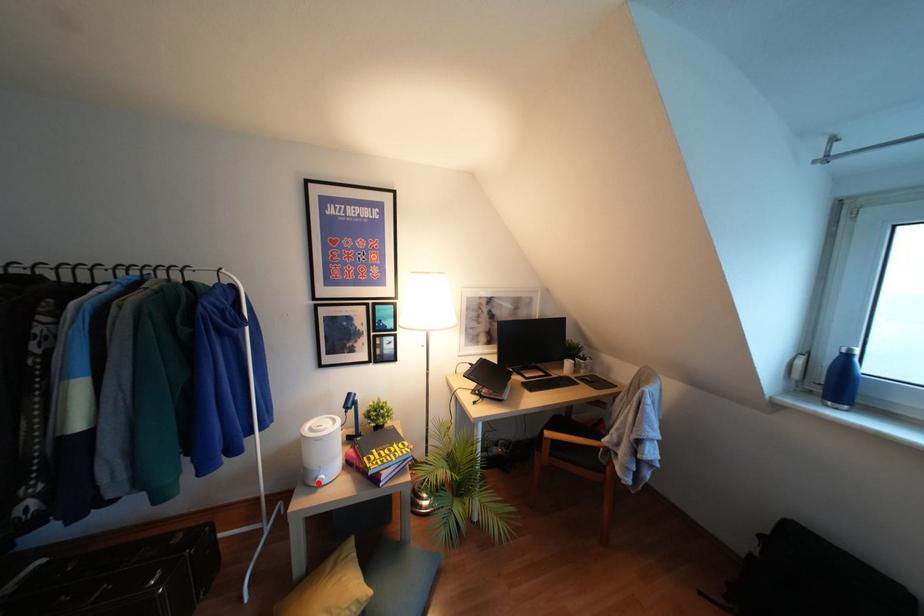
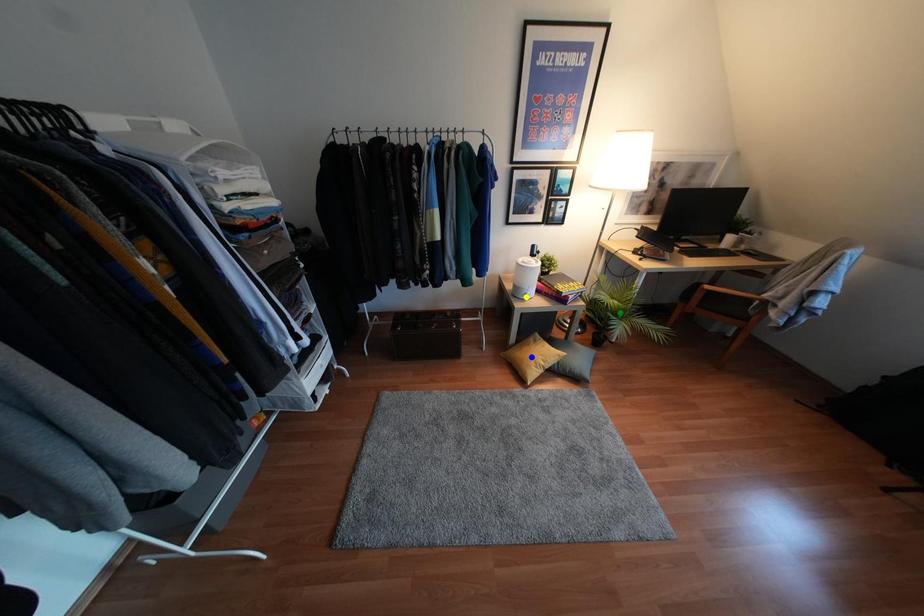
Question: I am providing you with two images of the same scene from different viewpoints. A red point is marked on the first image. You are given multiple points on the second image. Which point in image 2 represents the same 3d spot as the red point in image 1?

Choices:
 (A) blue point
 (B) yellow point
 (C) green point

Answer: (B)